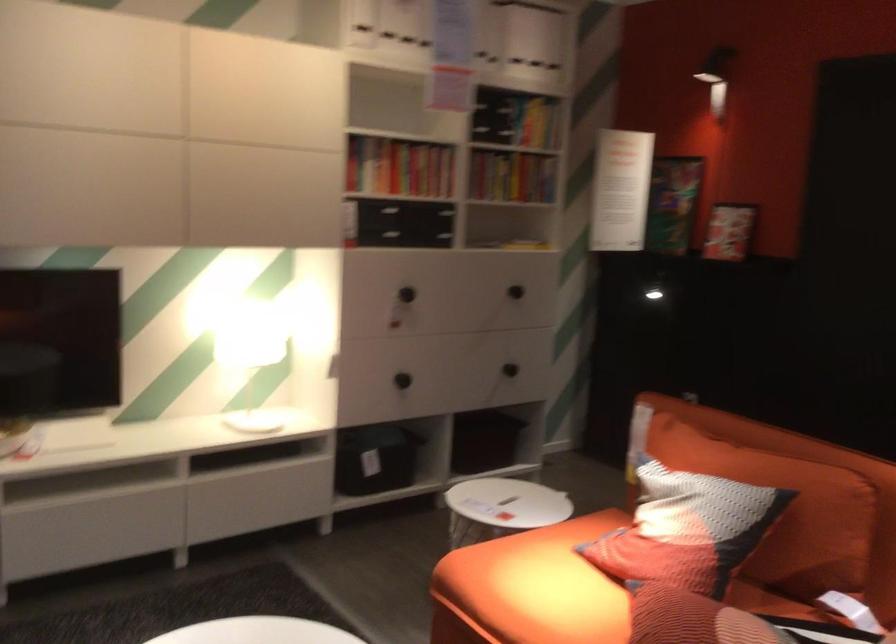
Where would you sit the sofa sitting surface? Please return your answer as a coordinate pair (x, y).

(531, 588)